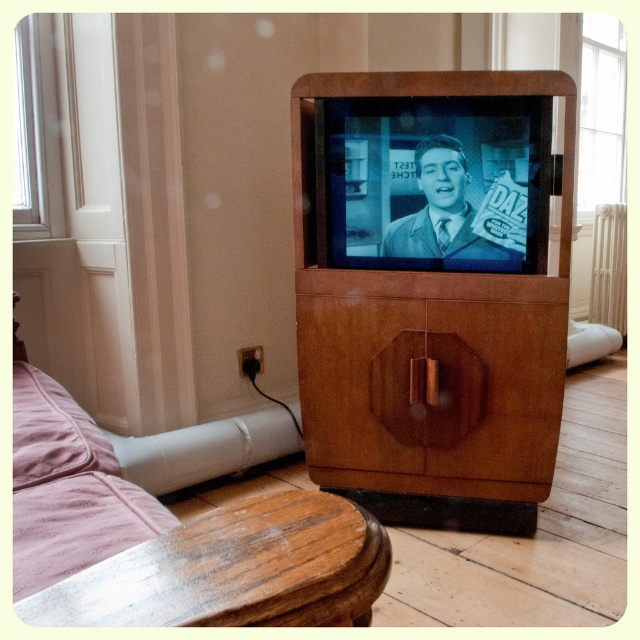
Is wooden cabinet at center bigger than wooden side table at lower left?

Yes, wooden cabinet at center is bigger than wooden side table at lower left.

This screenshot has height=640, width=640. What do you see at coordinates (432, 289) in the screenshot?
I see `wooden cabinet at center` at bounding box center [432, 289].

Image resolution: width=640 pixels, height=640 pixels. Identify the location of wooden cabinet at center. (432, 289).

Identify the location of wooden cabinet at center. (432, 289).